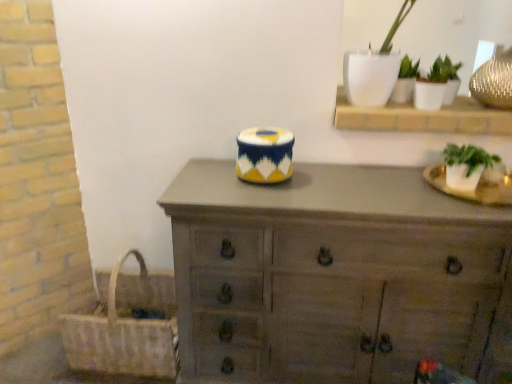
Question: From the image's perspective, is wooden chest of drawers at center above or below wooden shelf at upper right?

Choices:
 (A) below
 (B) above

Answer: (A)

Question: Is point (283, 274) positioned closer to the camera than point (471, 132)?

Choices:
 (A) closer
 (B) farther

Answer: (A)

Question: Estimate the real-world distances between objects in this image. Which object is farther from the green leafy plant in clear pot at right, the 3th houseplant from the top?

Choices:
 (A) wooden shelf at upper right
 (B) white ceramic pot at upper right, the second houseplant positioned from the bottom
 (C) white glossy pot at upper right, acting as the first houseplant starting from the top
 (D) wooden chest of drawers at center
 (E) woven straw picnic basket at lower left

Answer: (E)

Question: Considering the real-world distances, which object is closest to the white ceramic pot at upper right, the second houseplant positioned from the bottom?

Choices:
 (A) wooden shelf at upper right
 (B) green leafy plant in clear pot at right, the 3th houseplant from the top
 (C) wooden chest of drawers at center
 (D) woven straw picnic basket at lower left
 (E) white glossy pot at upper right, acting as the first houseplant starting from the top

Answer: (E)